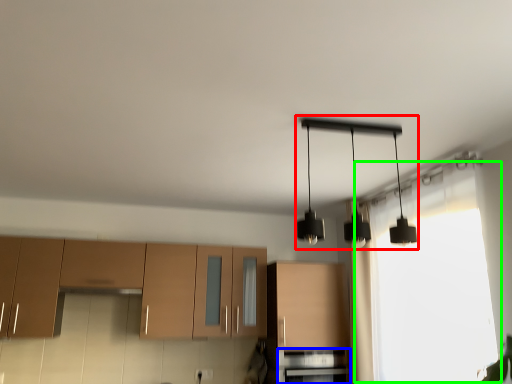
Question: Which object is the farthest from lamp (highlighted by a red box)? Choose among these: oven (highlighted by a blue box) or window (highlighted by a green box).

Choices:
 (A) oven
 (B) window

Answer: (A)